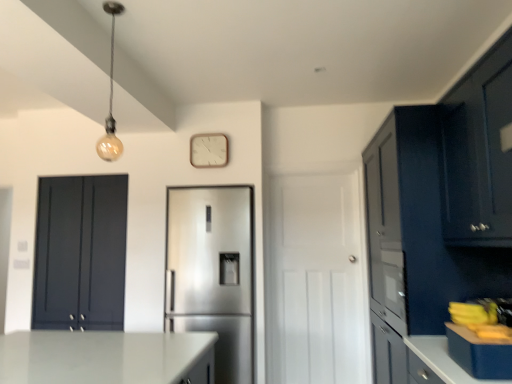
Where is `blank space situated above matte dark blue cabinet at left, the 1th cabinetry in the left-to-right sequence (from a real-world perspective)`? The width and height of the screenshot is (512, 384). blank space situated above matte dark blue cabinet at left, the 1th cabinetry in the left-to-right sequence (from a real-world perspective) is located at coordinates (84, 169).